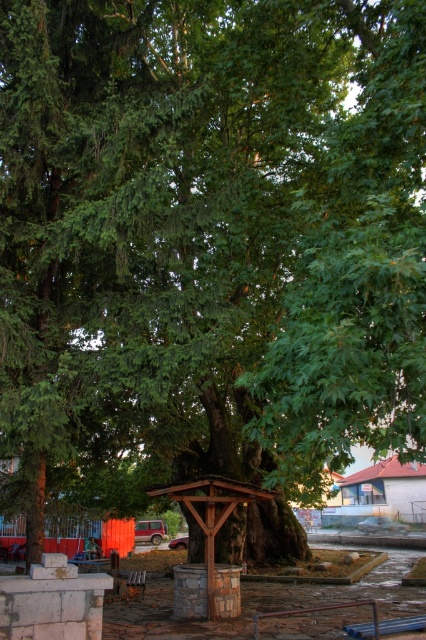
You are planning to place a new bench in the scene. The bench needs to be placed exactly at the coordinates of the wooden picnic table at center. What are the coordinates where you should place the bench?

The coordinates for the wooden picnic table at center are 0.878 and 0.214, so you should place the bench at those coordinates.

You are standing at the base of the ancient tree and want to walk towards the stone wall. There are two points marked on the ground, point (81, 563) and point (144, 586). Which point should you step on first to stay on the path leading to the stone wall?

Point (81, 563) is behind point (144, 586), so you should step on point (144, 586) first before reaching point (81, 563) to stay on the path leading to the stone wall.